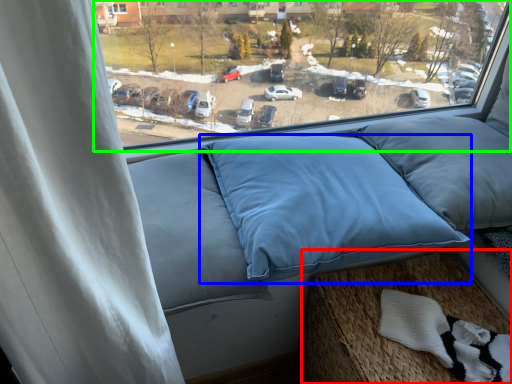
Question: Considering the real-world distances, which object is farthest from bed frame (highlighted by a red box)? pillow (highlighted by a blue box) or window (highlighted by a green box)?

Choices:
 (A) pillow
 (B) window

Answer: (B)